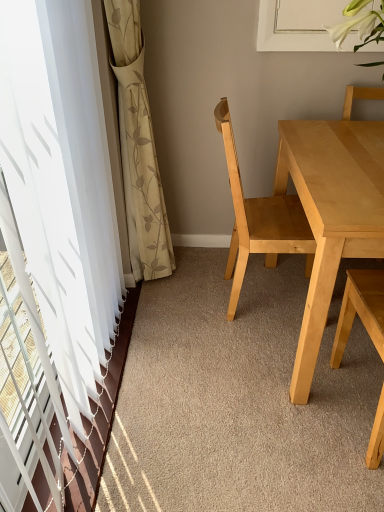
Question: Considering the relative sizes of light wood table at center and light wood chair at right, the first chair viewed from the right, in the image provided, is light wood table at center wider than light wood chair at right, the first chair viewed from the right,?

Choices:
 (A) yes
 (B) no

Answer: (A)

Question: Can you confirm if light wood table at center is shorter than light wood chair at right, the 2th chair viewed from the left?

Choices:
 (A) yes
 (B) no

Answer: (A)

Question: Is light wood table at center not near light wood chair at right, the 2th chair viewed from the left?

Choices:
 (A) yes
 (B) no

Answer: (B)

Question: Is light wood chair at right, the 2th chair viewed from the left, a part of light wood table at center?

Choices:
 (A) no
 (B) yes

Answer: (B)

Question: Can you confirm if light wood table at center is taller than light wood chair at right, the 2th chair viewed from the left?

Choices:
 (A) yes
 (B) no

Answer: (B)

Question: Can you confirm if light wood table at center is smaller than light wood chair at right, the 2th chair viewed from the left?

Choices:
 (A) no
 (B) yes

Answer: (A)

Question: Considering the relative sizes of light wood table at center and beige floral fabric curtain at left in the image provided, is light wood table at center wider than beige floral fabric curtain at left?

Choices:
 (A) yes
 (B) no

Answer: (A)

Question: From a real-world perspective, is light wood table at center under beige floral fabric curtain at left?

Choices:
 (A) no
 (B) yes

Answer: (B)

Question: Is light wood table at center in contact with beige floral fabric curtain at left?

Choices:
 (A) yes
 (B) no

Answer: (B)

Question: From a real-world perspective, is light wood table at center on top of beige floral fabric curtain at left?

Choices:
 (A) yes
 (B) no

Answer: (B)

Question: Is beige floral fabric curtain at left a part of light wood table at center?

Choices:
 (A) yes
 (B) no

Answer: (B)

Question: Would you say light wood table at center is a long distance from beige floral fabric curtain at left?

Choices:
 (A) yes
 (B) no

Answer: (B)

Question: Is light wood table at center far from white sheer curtain at left?

Choices:
 (A) yes
 (B) no

Answer: (B)